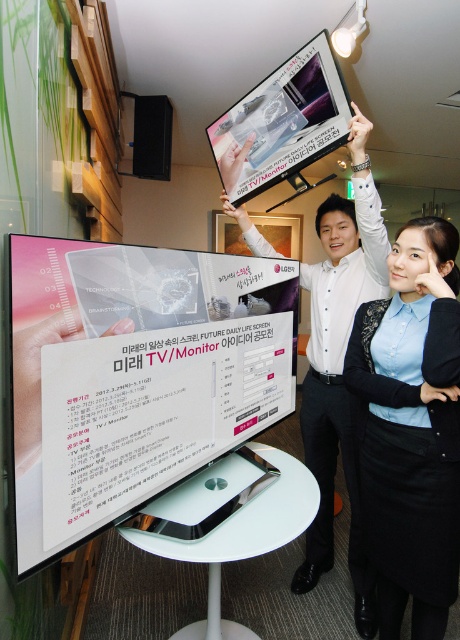
Between point (247, 420) and point (263, 88), which one is positioned behind?

The point (263, 88) is more distant.

The width and height of the screenshot is (460, 640). What are the coordinates of `metallic silver monitor at center` in the screenshot? It's located at (136, 376).

Between white glossy screen at left and satin black monitor at upper center, which one has less height?

satin black monitor at upper center

Describe the element at coordinates (35, 228) in the screenshot. The width and height of the screenshot is (460, 640). I see `white glossy screen at left` at that location.

The width and height of the screenshot is (460, 640). In order to click on white glossy screen at left in this screenshot , I will do `click(35, 228)`.

Can you confirm if white glossy screen at left is thinner than white glossy monitor at upper center?

Correct, white glossy screen at left's width is less than white glossy monitor at upper center's.

Who is higher up, white glossy screen at left or white glossy monitor at upper center?

Positioned higher is white glossy screen at left.

Between point (4, 353) and point (360, 240), which one is positioned behind?

The point (360, 240) is behind.

You are a GUI agent. You are given a task and a screenshot of the screen. Output one action in this format:
    pyautogui.click(x=<x>, y=<y>)
    Task: Click on the white glossy screen at left
    This screenshot has height=640, width=460.
    Given the screenshot: What is the action you would take?
    pyautogui.click(x=35, y=228)